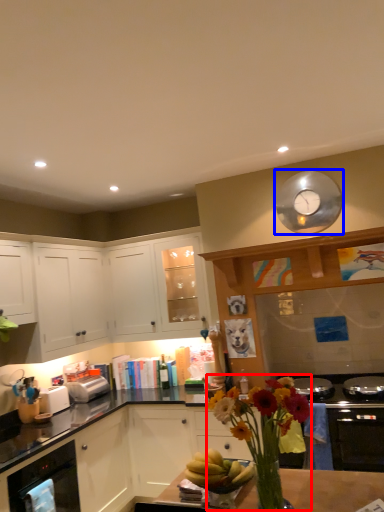
Question: Which of the following is the farthest to the observer, floral arrangement (highlighted by a red box) or clock (highlighted by a blue box)?

Choices:
 (A) floral arrangement
 (B) clock

Answer: (B)